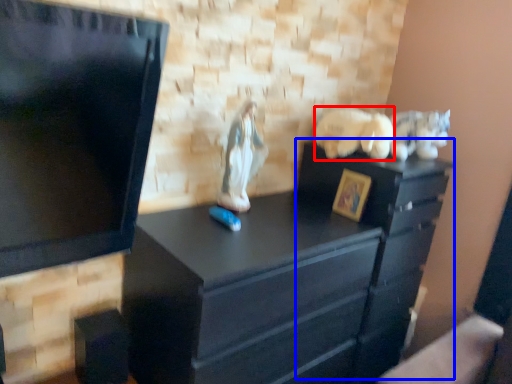
Question: Among these objects, which one is farthest to the camera, animal (highlighted by a red box) or file cabinet (highlighted by a blue box)?

Choices:
 (A) animal
 (B) file cabinet

Answer: (A)